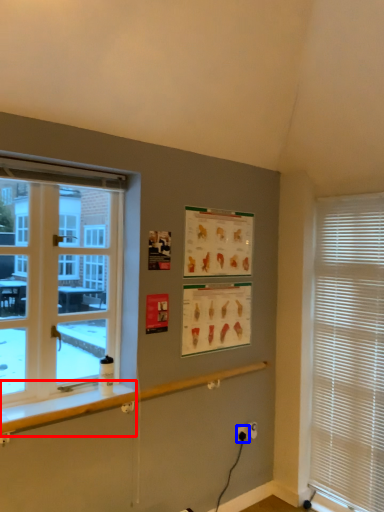
Question: Which point is closer to the camera, window sill (highlighted by a red box) or electric outlet (highlighted by a blue box)?

Choices:
 (A) window sill
 (B) electric outlet

Answer: (A)